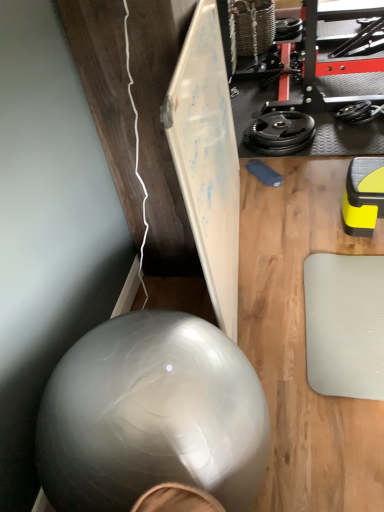
Locate an element on the screen. The width and height of the screenshot is (384, 512). vacant space in black rubber weight at upper right (from a real-world perspective) is located at coordinates (285, 136).